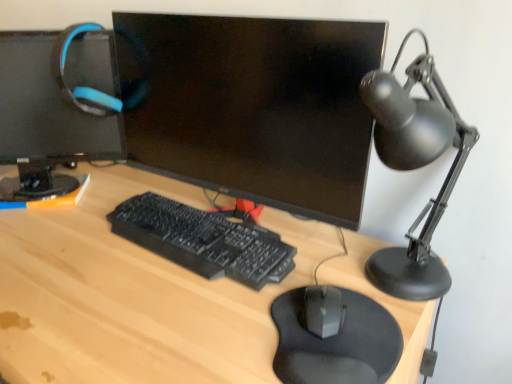
The height and width of the screenshot is (384, 512). Find the location of `light wood desk at center`. light wood desk at center is located at coordinates click(x=134, y=295).

The width and height of the screenshot is (512, 384). Identify the location of matte black monitor at upper left, placed as the 1th computer monitor when sorted from left to right. (56, 108).

At what (x,y) coordinates should I click in order to perform the action: click on black matte mousepad at lower center. Please return your answer as a coordinate pair (x, y). Looking at the image, I should click on (335, 341).

Measure the distance between point (306, 381) and camera.

Point (306, 381) is 56.00 centimeters away from camera.

Locate an element on the screen. This screenshot has width=512, height=384. black matte mouse at center is located at coordinates (324, 310).

This screenshot has width=512, height=384. What do you see at coordinates (324, 310) in the screenshot?
I see `black matte mouse at center` at bounding box center [324, 310].

Identify the location of light wood desk at center. (134, 295).

From the image's perspective, is matte black monitor at center, acting as the 2th computer monitor starting from the left, located beneath black matte desk lamp at right?

Incorrect, from the image's perspective, matte black monitor at center, acting as the 2th computer monitor starting from the left, is higher than black matte desk lamp at right.

Looking at this image, which object is closer to the camera taking this photo, matte black monitor at center, acting as the 2th computer monitor starting from the left, or black matte desk lamp at right?

black matte desk lamp at right is in front.

From a real-world perspective, does matte black monitor at center, acting as the 2th computer monitor starting from the left, sit lower than black matte desk lamp at right?

No, from a real-world perspective, matte black monitor at center, acting as the 2th computer monitor starting from the left, is not below black matte desk lamp at right.

Considering the positions of objects matte black monitor at center, acting as the 1th computer monitor starting from the right, and black matte desk lamp at right in the image provided, who is more to the right, matte black monitor at center, acting as the 1th computer monitor starting from the right, or black matte desk lamp at right?

black matte desk lamp at right.

From a real-world perspective, between matte black monitor at upper left, placed as the 1th computer monitor when sorted from left to right, and black matte desk lamp at right, who is vertically lower?

black matte desk lamp at right, from a real-world perspective.

Would you say matte black monitor at upper left, which is the second computer monitor from right to left, is inside or outside black matte desk lamp at right?

The correct answer is: outside.

Is black matte mousepad at lower center at the left side of black matte mouse at center?

Indeed, black matte mousepad at lower center is positioned on the left side of black matte mouse at center.

Which object is thinner, black matte mousepad at lower center or black matte mouse at center?

With smaller width is black matte mouse at center.

Is black matte mousepad at lower center placed right next to black matte mouse at center?

Yes, black matte mousepad at lower center is right next to black matte mouse at center and making contact.

Would you say black matte mousepad at lower center is outside black matte desk lamp at right?

Yes.

Considering the positions of objects black matte mousepad at lower center and black matte desk lamp at right in the image provided, who is more to the right, black matte mousepad at lower center or black matte desk lamp at right?

black matte desk lamp at right.

Does black matte mousepad at lower center come in front of black matte desk lamp at right?

No, it is not.

At what (x,y) coordinates should I click in order to perform the action: click on table lamp that appears above the black matte mousepad at lower center (from a real-world perspective). Please return your answer as a coordinate pair (x, y). The image size is (512, 384). Looking at the image, I should click on (415, 168).

From the picture: From the image's perspective, is matte black monitor at center, acting as the 1th computer monitor starting from the right, on black plastic keyboard at center?

Yes.

Based on the photo, could you measure the distance between matte black monitor at center, acting as the 1th computer monitor starting from the right, and black plastic keyboard at center?

matte black monitor at center, acting as the 1th computer monitor starting from the right, is 7.91 inches from black plastic keyboard at center.

Is matte black monitor at center, acting as the 1th computer monitor starting from the right, not near black plastic keyboard at center?

Actually, matte black monitor at center, acting as the 1th computer monitor starting from the right, and black plastic keyboard at center are a little close together.

Which object is further away from the camera, matte black monitor at center, acting as the 1th computer monitor starting from the right, or black plastic keyboard at center?

black plastic keyboard at center.

From the image's perspective, is black matte desk lamp at right above matte black monitor at center, acting as the 2th computer monitor starting from the left?

No, from the image's perspective, black matte desk lamp at right is not over matte black monitor at center, acting as the 2th computer monitor starting from the left.

Are black matte desk lamp at right and matte black monitor at center, acting as the 2th computer monitor starting from the left, far apart?

No, black matte desk lamp at right is not far from matte black monitor at center, acting as the 2th computer monitor starting from the left.

Consider the image. Considering their positions, is black matte desk lamp at right located in front of or behind matte black monitor at center, acting as the 1th computer monitor starting from the right?

Visually, black matte desk lamp at right is located in front of matte black monitor at center, acting as the 1th computer monitor starting from the right.

Is black matte desk lamp at right taller or shorter than matte black monitor at center, acting as the 1th computer monitor starting from the right?

black matte desk lamp at right is shorter than matte black monitor at center, acting as the 1th computer monitor starting from the right.

Are black matte desk lamp at right and matte black monitor at upper left, placed as the 1th computer monitor when sorted from left to right, located far from each other?

They are positioned close to each other.

Is black matte desk lamp at right wider than matte black monitor at upper left, which is the second computer monitor from right to left?

Indeed, black matte desk lamp at right has a greater width compared to matte black monitor at upper left, which is the second computer monitor from right to left.

Which point is more distant from viewer, [377,268] or [31,51]?

The point [31,51] is farther.

Who is smaller, black matte desk lamp at right or matte black monitor at upper left, placed as the 1th computer monitor when sorted from left to right?

black matte desk lamp at right is smaller.

The width and height of the screenshot is (512, 384). I want to click on table lamp below the matte black monitor at center, acting as the 2th computer monitor starting from the left (from a real-world perspective), so click(415, 168).

At what (x,y) coordinates should I click in order to perform the action: click on table lamp that appears in front of the matte black monitor at upper left, placed as the 1th computer monitor when sorted from left to right. Please return your answer as a coordinate pair (x, y). Image resolution: width=512 pixels, height=384 pixels. Looking at the image, I should click on (415, 168).

Based on their spatial positions, is black matte mousepad at lower center or black plastic keyboard at center closer to black matte desk lamp at right?

Based on the image, black matte mousepad at lower center appears to be nearer to black matte desk lamp at right.

Based on the photo, when comparing their distances from black matte mousepad at lower center, does black matte mouse at center or black matte desk lamp at right seem further?

black matte desk lamp at right.

Which object lies nearer to the anchor point matte black monitor at upper left, placed as the 1th computer monitor when sorted from left to right, black matte mousepad at lower center or matte black monitor at center, acting as the 2th computer monitor starting from the left?

matte black monitor at center, acting as the 2th computer monitor starting from the left.

From the image, which object appears to be nearer to black plastic keyboard at center, black matte mouse at center or black matte desk lamp at right?

black matte mouse at center is closer to black plastic keyboard at center.

Looking at this image, from the image, which object appears to be nearer to black matte desk lamp at right, matte black monitor at upper left, placed as the 1th computer monitor when sorted from left to right, or light wood desk at center?

Based on the image, light wood desk at center appears to be nearer to black matte desk lamp at right.

From the image, which object appears to be farther from black matte mouse at center, matte black monitor at center, acting as the 2th computer monitor starting from the left, or black matte mousepad at lower center?

Among the two, matte black monitor at center, acting as the 2th computer monitor starting from the left, is located further to black matte mouse at center.

Based on the photo, estimate the real-world distances between objects in this image. Which object is further from black matte mousepad at lower center, black plastic keyboard at center or light wood desk at center?

light wood desk at center.

Consider the image. Looking at the image, which one is located further to light wood desk at center, black matte mouse at center or black plastic keyboard at center?

The object further to light wood desk at center is black matte mouse at center.

What are the coordinates of `mouse between black matte desk lamp at right and black matte mousepad at lower center vertically` in the screenshot? It's located at (324, 310).

Locate an element on the screen. The image size is (512, 384). computer monitor between matte black monitor at upper left, which is the second computer monitor from right to left, and black matte desk lamp at right, in the horizontal direction is located at coordinates (252, 106).

Where is `table lamp between matte black monitor at center, acting as the 1th computer monitor starting from the right, and black matte mouse at center in the up-down direction`? The height and width of the screenshot is (384, 512). table lamp between matte black monitor at center, acting as the 1th computer monitor starting from the right, and black matte mouse at center in the up-down direction is located at coordinates (415, 168).

Find the location of a particular element. The width and height of the screenshot is (512, 384). mousepad between matte black monitor at upper left, placed as the 1th computer monitor when sorted from left to right, and light wood desk at center, in the vertical direction is located at coordinates (335, 341).